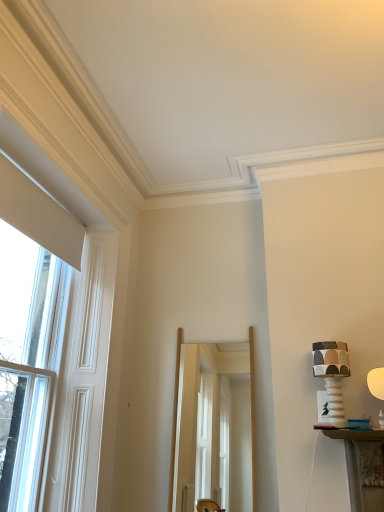
Question: Considering the relative sizes of matte ceramic lampshade at right, which ranks as the second table lamp in left-to-right order, and clear glass window at left in the image provided, is matte ceramic lampshade at right, which ranks as the second table lamp in left-to-right order, wider than clear glass window at left?

Choices:
 (A) yes
 (B) no

Answer: (B)

Question: Is matte ceramic lampshade at right, positioned as the first table lamp in right-to-left order, aimed at clear glass window at left?

Choices:
 (A) no
 (B) yes

Answer: (A)

Question: Is clear glass window at left surrounded by matte ceramic lampshade at right, which ranks as the second table lamp in left-to-right order?

Choices:
 (A) no
 (B) yes

Answer: (A)

Question: From the image's perspective, is matte ceramic lampshade at right, positioned as the first table lamp in right-to-left order, above clear glass window at left?

Choices:
 (A) no
 (B) yes

Answer: (A)

Question: Is matte ceramic lampshade at right, which ranks as the second table lamp in left-to-right order, looking in the opposite direction of clear glass window at left?

Choices:
 (A) no
 (B) yes

Answer: (A)

Question: From a real-world perspective, relative to clear glass screen door at center, is patterned fabric lampshade at right, which appears as the 2th table lamp when viewed from the right, vertically above or below?

Choices:
 (A) below
 (B) above

Answer: (B)

Question: Is patterned fabric lampshade at right, arranged as the 1th table lamp when viewed from the left, bigger or smaller than clear glass screen door at center?

Choices:
 (A) small
 (B) big

Answer: (A)

Question: From the image's perspective, is patterned fabric lampshade at right, which appears as the 2th table lamp when viewed from the right, located above or below clear glass screen door at center?

Choices:
 (A) below
 (B) above

Answer: (B)

Question: Is patterned fabric lampshade at right, which appears as the 2th table lamp when viewed from the right, inside or outside of clear glass screen door at center?

Choices:
 (A) outside
 (B) inside

Answer: (A)

Question: In the image, is clear glass window at left positioned in front of or behind clear glass screen door at center?

Choices:
 (A) behind
 (B) front

Answer: (B)

Question: Is clear glass window at left taller or shorter than clear glass screen door at center?

Choices:
 (A) short
 (B) tall

Answer: (B)

Question: Considering the positions of clear glass window at left and clear glass screen door at center in the image, is clear glass window at left wider or thinner than clear glass screen door at center?

Choices:
 (A) wide
 (B) thin

Answer: (A)

Question: Does point [x=23, y=208] appear closer or farther from the camera than point [x=253, y=402]?

Choices:
 (A) farther
 (B) closer

Answer: (B)

Question: Considering the positions of clear glass window at left and matte ceramic lampshade at right, positioned as the first table lamp in right-to-left order, in the image, is clear glass window at left wider or thinner than matte ceramic lampshade at right, positioned as the first table lamp in right-to-left order,?

Choices:
 (A) wide
 (B) thin

Answer: (A)

Question: Is clear glass window at left spatially inside matte ceramic lampshade at right, positioned as the first table lamp in right-to-left order, or outside of it?

Choices:
 (A) outside
 (B) inside

Answer: (A)